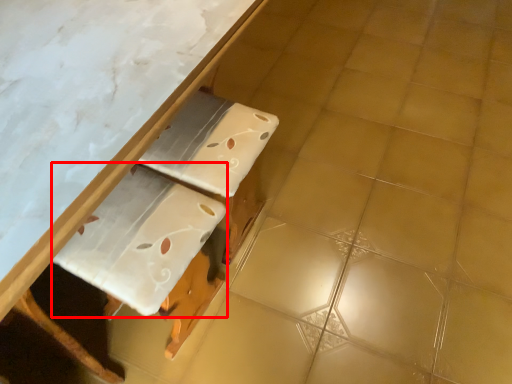
Question: From the image, what is the correct spatial relationship of cardboard (annotated by the red box) in relation to table?

Choices:
 (A) left
 (B) right

Answer: (B)